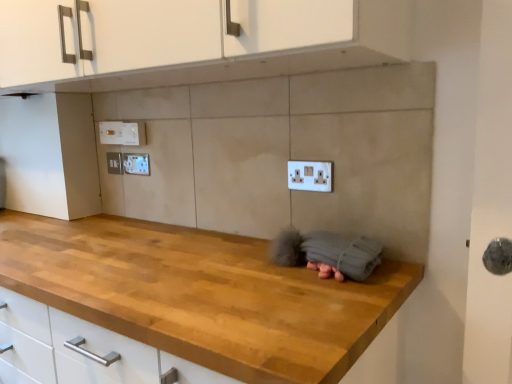
Question: Considering the relative sizes of white plastic electric outlet at upper left, marked as the first electric outlet in a left-to-right arrangement, and white plastic electric outlet at center, the first electric outlet positioned from the right, in the image provided, is white plastic electric outlet at upper left, marked as the first electric outlet in a left-to-right arrangement, bigger than white plastic electric outlet at center, the first electric outlet positioned from the right,?

Choices:
 (A) no
 (B) yes

Answer: (A)

Question: Considering the relative sizes of white plastic electric outlet at upper left, positioned as the 4th electric outlet in right-to-left order, and white plastic electric outlet at center, which is the fourth electric outlet in left-to-right order, in the image provided, is white plastic electric outlet at upper left, positioned as the 4th electric outlet in right-to-left order, shorter than white plastic electric outlet at center, which is the fourth electric outlet in left-to-right order,?

Choices:
 (A) yes
 (B) no

Answer: (A)

Question: Is white plastic electric outlet at upper left, marked as the first electric outlet in a left-to-right arrangement, positioned far away from white plastic electric outlet at center, the first electric outlet positioned from the right?

Choices:
 (A) yes
 (B) no

Answer: (B)

Question: Can you confirm if white plastic electric outlet at upper left, positioned as the 4th electric outlet in right-to-left order, is positioned to the right of white plastic electric outlet at center, placed as the fourth electric outlet when sorted from back to front?

Choices:
 (A) no
 (B) yes

Answer: (A)

Question: From a real-world perspective, is white plastic electric outlet at upper left, positioned as the 4th electric outlet in front-to-back order, positioned under white plastic electric outlet at center, the first electric outlet positioned from the right, based on gravity?

Choices:
 (A) no
 (B) yes

Answer: (A)

Question: From the image's perspective, does white plastic electric outlet at upper left, arranged as the 1th electric outlet when viewed from the back, appear higher than white plastic electric outlet at center, which is counted as the 1th electric outlet, starting from the front?

Choices:
 (A) no
 (B) yes

Answer: (B)

Question: Is white plastic electric outlet at center, which is counted as the 1th electric outlet, starting from the front, taller than white plastic electric outlet at upper left, which is the third electric outlet in left-to-right order?

Choices:
 (A) no
 (B) yes

Answer: (B)

Question: Can you confirm if white plastic electric outlet at center, placed as the fourth electric outlet when sorted from back to front, is wider than white plastic electric outlet at upper left, the second electric outlet positioned from the right?

Choices:
 (A) no
 (B) yes

Answer: (B)

Question: Is white plastic electric outlet at center, the first electric outlet positioned from the right, far from white plastic electric outlet at upper left, which is the third electric outlet in left-to-right order?

Choices:
 (A) yes
 (B) no

Answer: (B)

Question: Can you see white plastic electric outlet at center, which is the fourth electric outlet in left-to-right order, touching white plastic electric outlet at upper left, which is the third electric outlet in left-to-right order?

Choices:
 (A) no
 (B) yes

Answer: (A)

Question: Is white plastic electric outlet at center, which is the fourth electric outlet in left-to-right order, shorter than white plastic electric outlet at upper left, the second electric outlet positioned from the right?

Choices:
 (A) yes
 (B) no

Answer: (B)

Question: From the image's perspective, is white plastic electric outlet at center, which is counted as the 1th electric outlet, starting from the front, below white plastic electric outlet at upper left, the second electric outlet positioned from the right?

Choices:
 (A) yes
 (B) no

Answer: (A)

Question: Is white plastic electric outlet at upper left, which is the third electric outlet from right to left, taller than white plastic electric outlet at upper left, the second electric outlet positioned from the right?

Choices:
 (A) no
 (B) yes

Answer: (B)